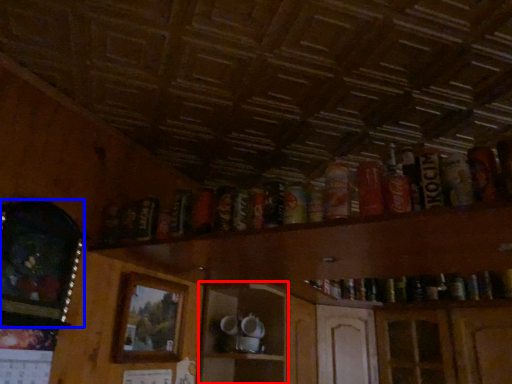
Question: Which of the following is the closest to the observer, shelf (highlighted by a red box) or picture frame (highlighted by a blue box)?

Choices:
 (A) shelf
 (B) picture frame

Answer: (B)